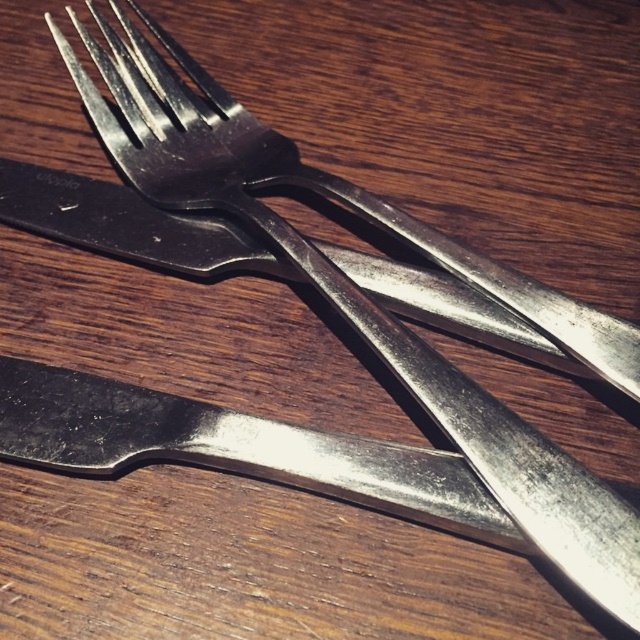
Question: Is polished silver knife at lower left to the left of polished metal fork at center from the viewer's perspective?

Choices:
 (A) no
 (B) yes

Answer: (B)

Question: Is polished silver knife at lower left below polished metal fork at center?

Choices:
 (A) no
 (B) yes

Answer: (B)

Question: Which point is farther to the camera?

Choices:
 (A) polished silver knife at lower left
 (B) polished metal fork at center

Answer: (B)

Question: Which object is closer to the camera taking this photo?

Choices:
 (A) polished silver knife at lower left
 (B) polished metal fork at center

Answer: (A)

Question: From the image, what is the correct spatial relationship of polished silver knife at lower left in relation to polished metal fork at center?

Choices:
 (A) below
 (B) above

Answer: (A)